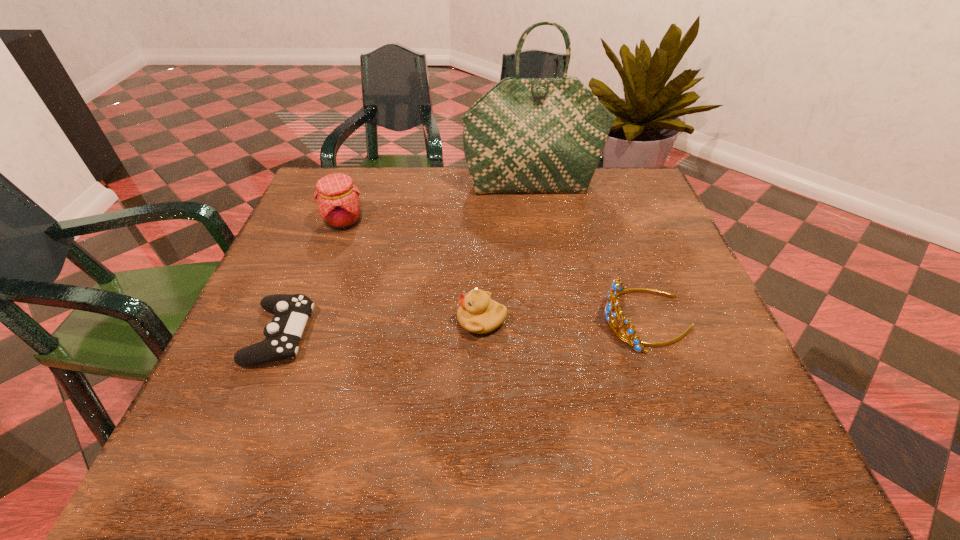
This screenshot has height=540, width=960. Find the location of `the tallest object`. the tallest object is located at coordinates (525, 135).

Identify the location of tote bag. The image size is (960, 540). (525, 135).

Find the location of a particular element. jam is located at coordinates click(337, 197).

Where is `tiara`? Image resolution: width=960 pixels, height=540 pixels. tiara is located at coordinates (617, 288).

The height and width of the screenshot is (540, 960). Find the location of `the fourth tallest object`. the fourth tallest object is located at coordinates (478, 314).

The width and height of the screenshot is (960, 540). Identify the location of the shortest object. (291, 311).

Where is `vacant space located on the left of the tote bag`? This screenshot has width=960, height=540. vacant space located on the left of the tote bag is located at coordinates (348, 186).

The height and width of the screenshot is (540, 960). What are the coordinates of `vacant space situated on the left of the second farthest object` in the screenshot? It's located at (295, 222).

Find the location of a particular element. The width and height of the screenshot is (960, 540). vacant space located 0.330m on the front-facing side of the tiara is located at coordinates [437, 320].

Where is `free space located 0.190m on the front-facing side of the tiara`? The width and height of the screenshot is (960, 540). free space located 0.190m on the front-facing side of the tiara is located at coordinates (507, 320).